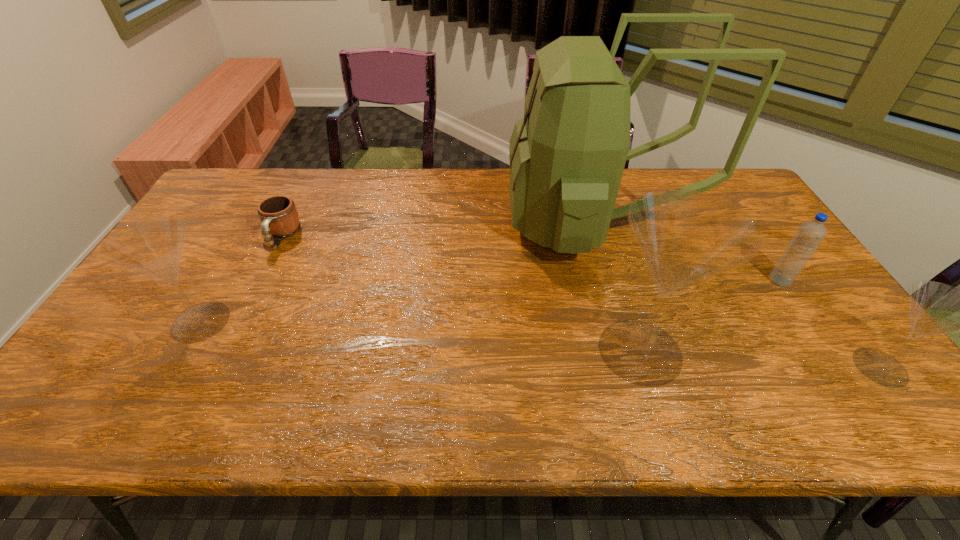
Identify the location of flute glass at the right edge. Image resolution: width=960 pixels, height=540 pixels. (935, 308).

In order to click on water bottle that is at the right edge in this screenshot , I will do `click(810, 234)`.

Identify the location of object that is at the near right corner. The height and width of the screenshot is (540, 960). (935, 308).

This screenshot has width=960, height=540. I want to click on free location at the far edge of the desktop, so coord(626,172).

Locate an element on the screen. vacant area at the near edge is located at coordinates (277, 372).

In the image, there is a desktop. At what (x,y) coordinates should I click in order to perform the action: click on blank space at the left edge. Please return your answer as a coordinate pair (x, y). Looking at the image, I should click on (212, 231).

Locate an element on the screen. This screenshot has width=960, height=540. vacant space in between the second shortest flute glass and the second flute glass from right to left is located at coordinates (420, 336).

Where is `unoccupied position between the rightmost flute glass and the second tallest object`? This screenshot has width=960, height=540. unoccupied position between the rightmost flute glass and the second tallest object is located at coordinates (x=760, y=359).

At what (x,y) coordinates should I click in order to perform the action: click on vacant space that's between the shortest flute glass and the shortest object. Please return your answer as a coordinate pair (x, y). The height and width of the screenshot is (540, 960). Looking at the image, I should click on (581, 302).

Where is `free space that is in between the second tallest flute glass and the tallest flute glass`? This screenshot has height=540, width=960. free space that is in between the second tallest flute glass and the tallest flute glass is located at coordinates (420, 336).